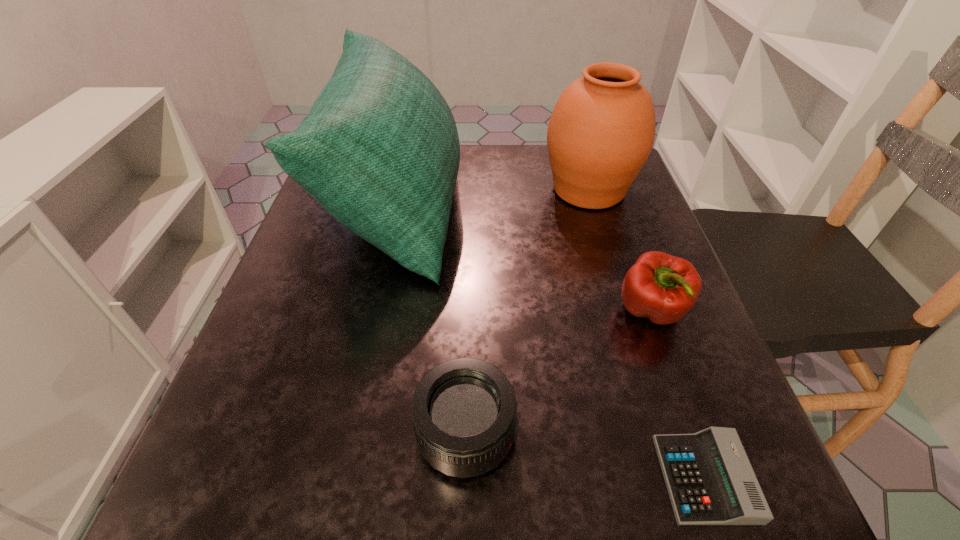
Find the location of a particular element. Image resolution: width=960 pixels, height=540 pixels. object that is positioned at the near right corner is located at coordinates (710, 481).

At what (x,y) coordinates should I click in order to perform the action: click on free space at the far edge of the desktop. Please return your answer as a coordinate pair (x, y). The height and width of the screenshot is (540, 960). Looking at the image, I should click on (498, 195).

Identify the location of vacant region at the near edge of the desktop. This screenshot has height=540, width=960. (389, 514).

This screenshot has width=960, height=540. I want to click on vacant region at the left edge of the desktop, so click(253, 336).

Find the location of a particular element. blank space at the right edge of the desktop is located at coordinates (602, 249).

Find the location of a particular element. free space at the near left corner is located at coordinates (196, 477).

Locate an element on the screen. This screenshot has height=540, width=960. vacant point located between the shortest object and the second shortest object is located at coordinates (586, 456).

The height and width of the screenshot is (540, 960). Find the location of `free space that is in between the bell pepper and the fourth tallest object`. free space that is in between the bell pepper and the fourth tallest object is located at coordinates (559, 373).

Locate an element on the screen. unoccupied area between the shortest object and the bell pepper is located at coordinates (678, 395).

The height and width of the screenshot is (540, 960). What are the coordinates of `vacant space that's between the cushion and the bell pepper` in the screenshot? It's located at tap(524, 258).